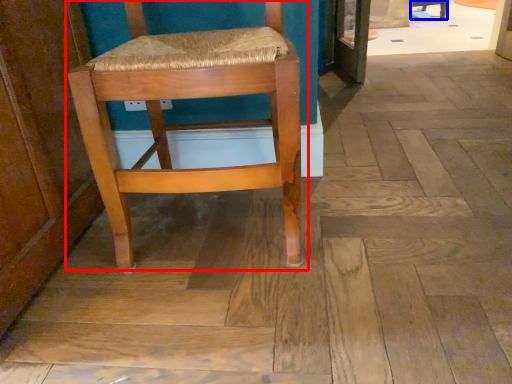
Question: Which point is further to the camera, chair (highlighted by a red box) or chair (highlighted by a blue box)?

Choices:
 (A) chair
 (B) chair

Answer: (B)